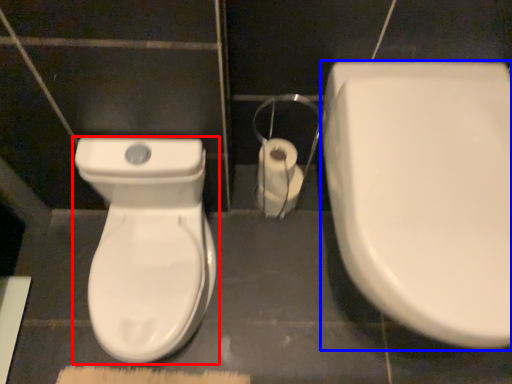
Question: Which of the following is the closest to the observer, toilet (highlighted by a red box) or toilet (highlighted by a blue box)?

Choices:
 (A) toilet
 (B) toilet

Answer: (B)